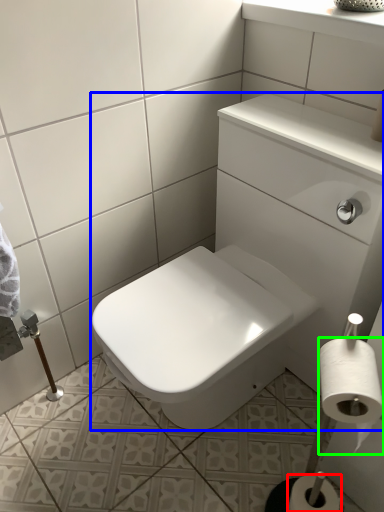
Question: Which is nearer to the toilet paper (highlighted by a red box)? sink (highlighted by a blue box) or toilet paper (highlighted by a green box).

Choices:
 (A) sink
 (B) toilet paper

Answer: (B)